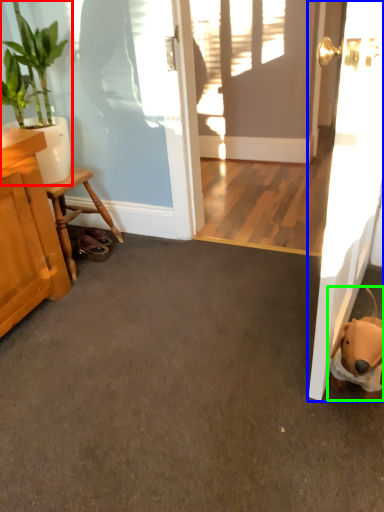
Question: Estimate the real-world distances between objects in this image. Which object is closer to houseplant (highlighted by a red box), door (highlighted by a blue box) or animal (highlighted by a green box)?

Choices:
 (A) door
 (B) animal

Answer: (A)